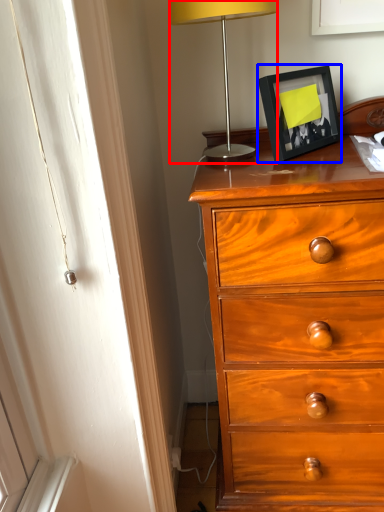
Question: Which point is closer to the camera, lamp (highlighted by a red box) or picture frame (highlighted by a blue box)?

Choices:
 (A) lamp
 (B) picture frame

Answer: (A)